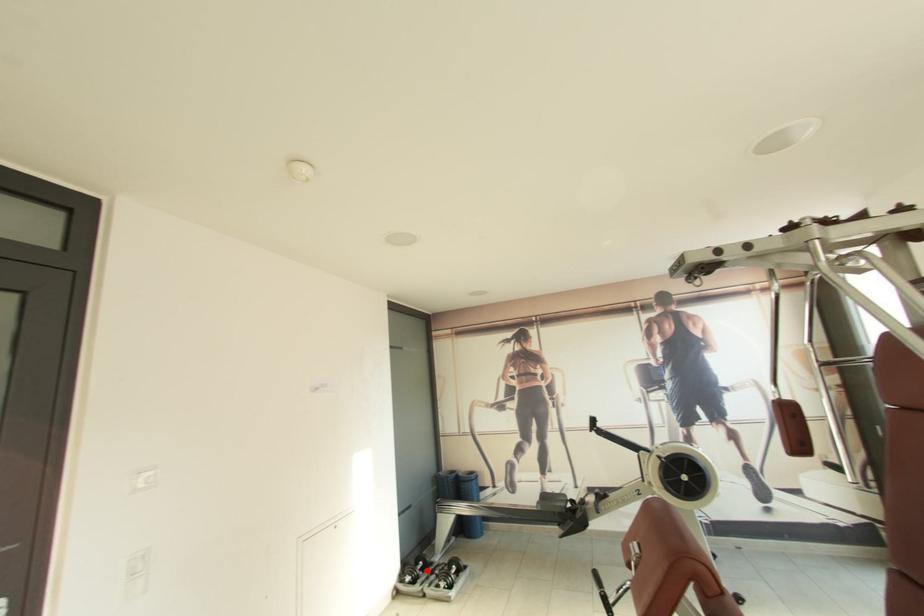
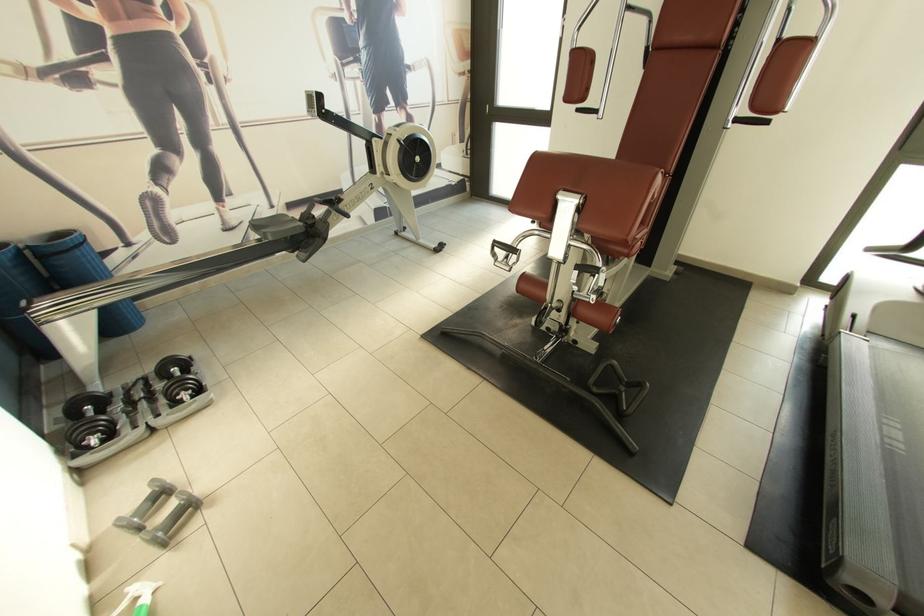
Question: A red point is marked in image1. In image2, is the corresponding 3D point closer to the camera or farther? Reply with the corresponding letter.

Choices:
 (A) The corresponding 3D point is closer.
 (B) The corresponding 3D point is farther.

Answer: (B)